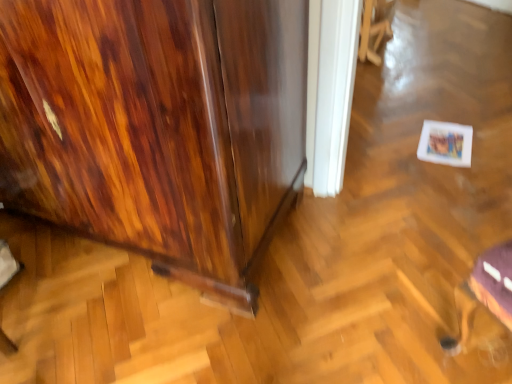
Question: Considering the relative positions of wooden swivel chair at upper center, acting as the 1th swivel chair starting from the back, and metallic silver swivel chair at lower right, arranged as the 2th swivel chair when viewed from the top, in the image provided, is wooden swivel chair at upper center, acting as the 1th swivel chair starting from the back, behind metallic silver swivel chair at lower right, arranged as the 2th swivel chair when viewed from the top,?

Choices:
 (A) no
 (B) yes

Answer: (B)

Question: Is wooden swivel chair at upper center, acting as the 1th swivel chair starting from the back, oriented away from metallic silver swivel chair at lower right, the 2th swivel chair viewed from the back?

Choices:
 (A) yes
 (B) no

Answer: (B)

Question: From a real-world perspective, is wooden swivel chair at upper center, acting as the 1th swivel chair starting from the back, below metallic silver swivel chair at lower right, arranged as the 2th swivel chair when viewed from the top?

Choices:
 (A) no
 (B) yes

Answer: (B)

Question: Is metallic silver swivel chair at lower right, the first swivel chair when ordered from front to back, surrounded by wooden swivel chair at upper center, acting as the 1th swivel chair starting from the back?

Choices:
 (A) yes
 (B) no

Answer: (B)

Question: Is wooden swivel chair at upper center, acting as the 1th swivel chair starting from the back, not near metallic silver swivel chair at lower right, which is the first swivel chair in bottom-to-top order?

Choices:
 (A) no
 (B) yes

Answer: (B)

Question: Is wooden swivel chair at upper center, acting as the 1th swivel chair starting from the back, outside of metallic silver swivel chair at lower right, the first swivel chair when ordered from front to back?

Choices:
 (A) no
 (B) yes

Answer: (B)

Question: Is metallic silver swivel chair at lower right, which is the first swivel chair in bottom-to-top order, oriented towards wooden cabinet at left?

Choices:
 (A) yes
 (B) no

Answer: (B)

Question: Is metallic silver swivel chair at lower right, arranged as the 2th swivel chair when viewed from the top, bigger than wooden cabinet at left?

Choices:
 (A) yes
 (B) no

Answer: (B)

Question: Can you confirm if metallic silver swivel chair at lower right, the first swivel chair when ordered from front to back, is wider than wooden cabinet at left?

Choices:
 (A) yes
 (B) no

Answer: (B)

Question: Is metallic silver swivel chair at lower right, the 2th swivel chair viewed from the back, at the right side of wooden cabinet at left?

Choices:
 (A) yes
 (B) no

Answer: (A)

Question: Does metallic silver swivel chair at lower right, the 2th swivel chair viewed from the back, have a lesser height compared to wooden cabinet at left?

Choices:
 (A) yes
 (B) no

Answer: (A)

Question: From a real-world perspective, is metallic silver swivel chair at lower right, arranged as the 2th swivel chair when viewed from the top, located beneath wooden swivel chair at upper center, positioned as the 2th swivel chair in front-to-back order?

Choices:
 (A) yes
 (B) no

Answer: (B)